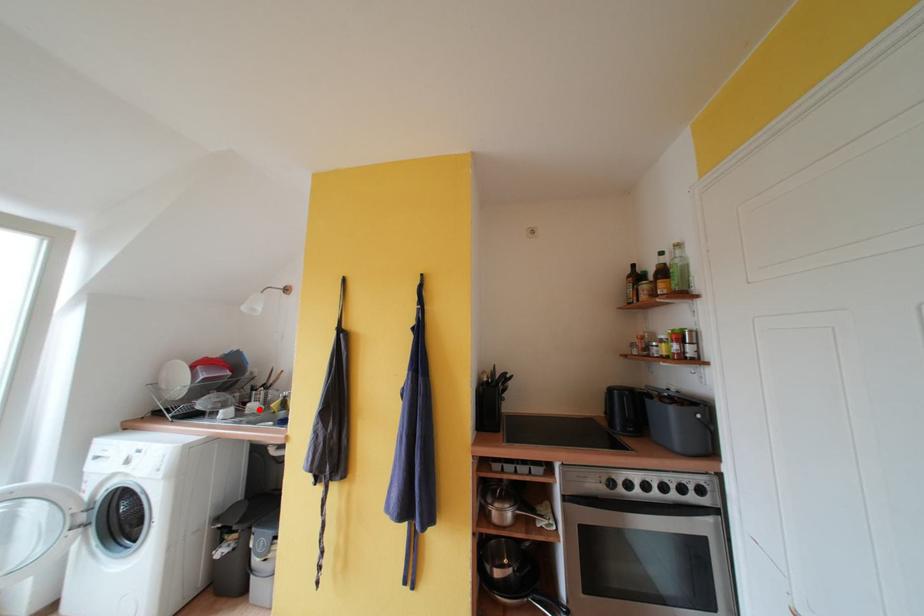
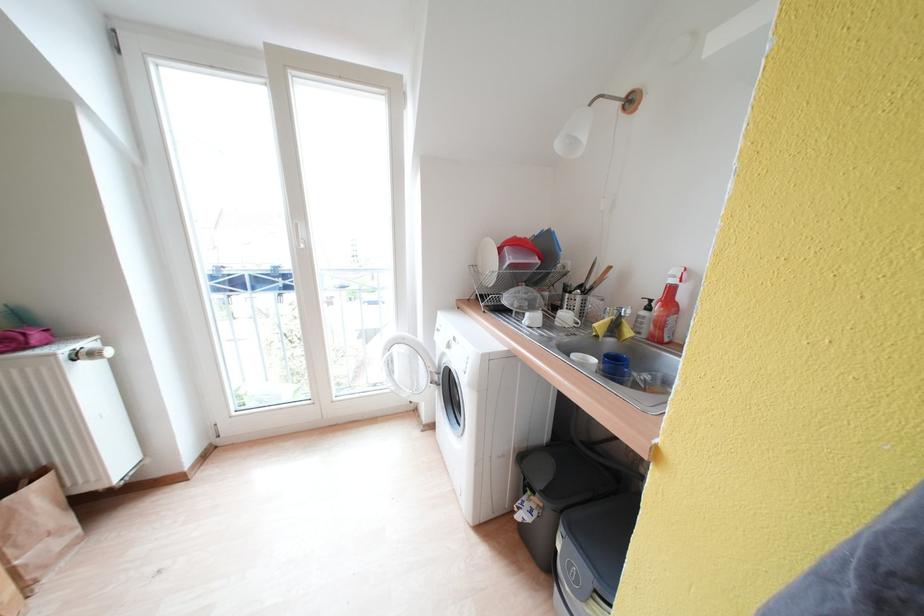
Where in the second image is the point corresponding to the highlighted location from the first image?

(572, 320)